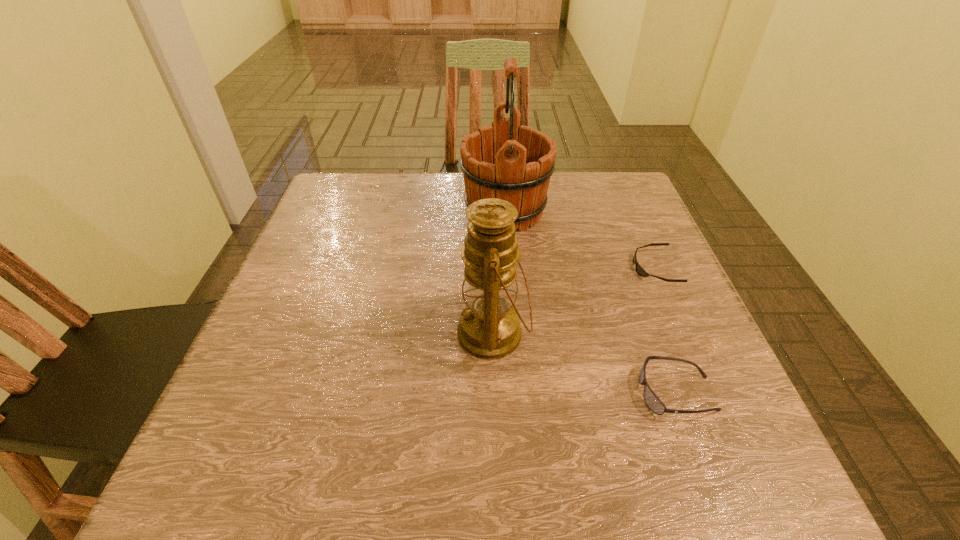
The width and height of the screenshot is (960, 540). I want to click on free space located on the lenses of the second shortest object, so click(493, 393).

Find the location of `vacant space located on the lenses of the second shortest object`. vacant space located on the lenses of the second shortest object is located at coordinates (536, 393).

The width and height of the screenshot is (960, 540). Find the location of `free spot located 0.220m on the front-facing side of the farther sunglasses`. free spot located 0.220m on the front-facing side of the farther sunglasses is located at coordinates (532, 268).

Where is `vacant space located 0.300m on the front-facing side of the farther sunglasses`? Image resolution: width=960 pixels, height=540 pixels. vacant space located 0.300m on the front-facing side of the farther sunglasses is located at coordinates (494, 268).

You are a GUI agent. You are given a task and a screenshot of the screen. Output one action in this format:
    pyautogui.click(x=<x>, y=<y>)
    Task: Click on the free region located 0.250m on the front-facing side of the farther sunglasses
    
    Given the screenshot: What is the action you would take?
    click(517, 268)

Locate an element on the screen. object situated at the far edge is located at coordinates (506, 161).

Where is `vacant area at the far edge`? Image resolution: width=960 pixels, height=540 pixels. vacant area at the far edge is located at coordinates (563, 173).

This screenshot has height=540, width=960. In the image, there is a desktop. In order to click on vacant space at the near edge in this screenshot , I will do `click(384, 440)`.

Find the location of a particular element. This screenshot has width=960, height=540. vacant space at the left edge is located at coordinates (279, 277).

Locate an element on the screen. This screenshot has width=960, height=540. vacant space at the right edge of the desktop is located at coordinates (690, 322).